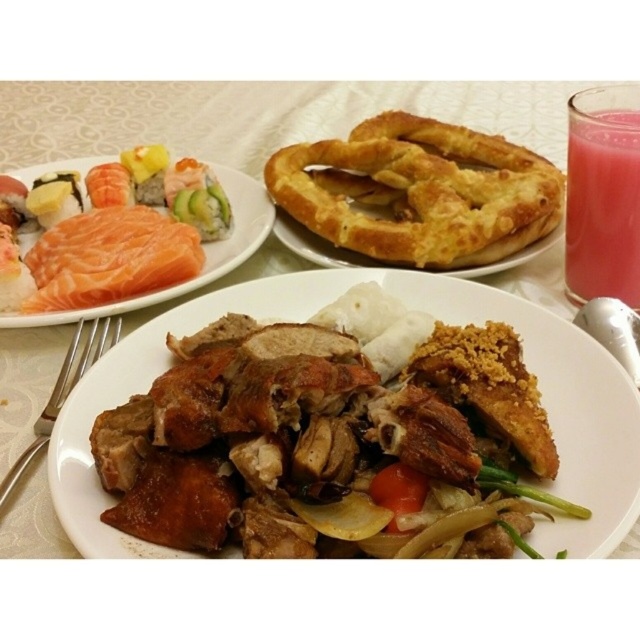
Question: Can you confirm if salmon raw at upper left is wider than silver fork at lower left?

Choices:
 (A) no
 (B) yes

Answer: (B)

Question: Which object is positioned closest to the salmon raw at upper left?

Choices:
 (A) pink translucent glass at upper right
 (B) silver fork at lower left
 (C) pink raw salmon at upper left
 (D) golden brown pretzel at upper right

Answer: (C)

Question: Which point is closer to the camera?

Choices:
 (A) golden brown pretzel at upper right
 (B) pink translucent glass at upper right

Answer: (B)

Question: From the image, what is the correct spatial relationship of brown crispy fried chicken at center in relation to silver fork at lower left?

Choices:
 (A) left
 (B) right

Answer: (B)

Question: Which object is the closest to the pink raw salmon at upper left?

Choices:
 (A) brown crispy fried chicken at center
 (B) silver fork at lower left
 (C) salmon raw at upper left
 (D) golden brown pretzel at upper right

Answer: (C)

Question: Is pink raw salmon at upper left below silver fork at lower left?

Choices:
 (A) no
 (B) yes

Answer: (A)